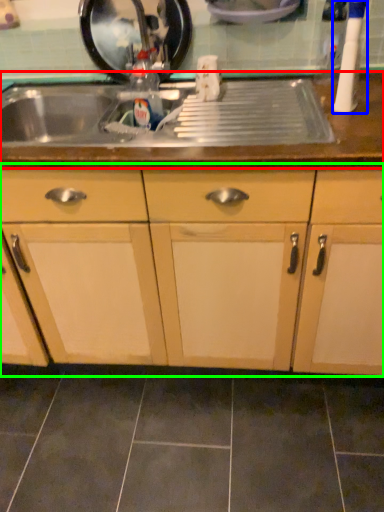
Question: Which object is the farthest from countertop (highlighted by a red box)? Choose among these: appliance (highlighted by a blue box) or cabinetry (highlighted by a green box).

Choices:
 (A) appliance
 (B) cabinetry

Answer: (B)